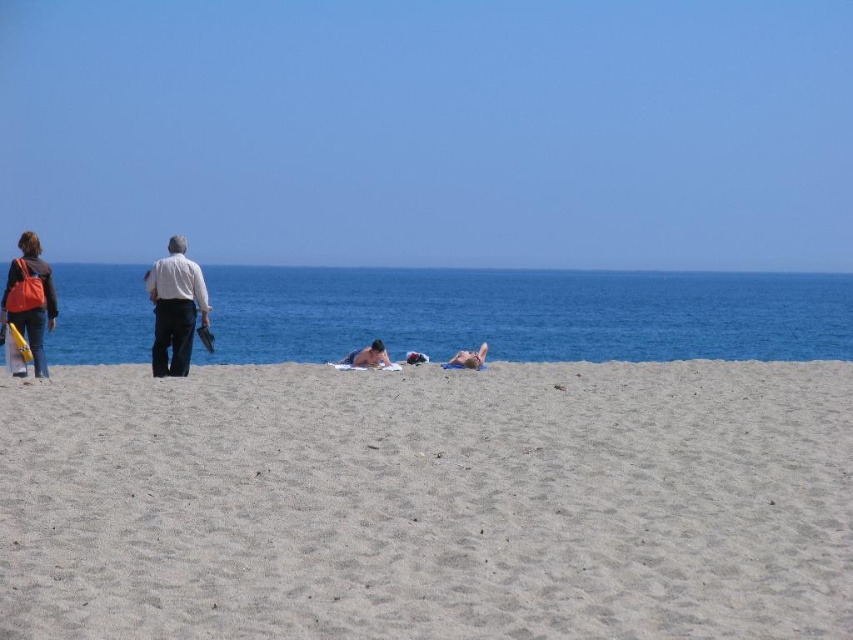
Question: Does light beige sand at center appear under blue water at center?

Choices:
 (A) no
 (B) yes

Answer: (B)

Question: Where is light beige sand at center located in relation to smooth skin at center in the image?

Choices:
 (A) below
 (B) above

Answer: (A)

Question: Is light beige sand at center further to the viewer compared to matte orange bag at left?

Choices:
 (A) yes
 (B) no

Answer: (B)

Question: Among these objects, which one is nearest to the camera?

Choices:
 (A) smooth tan skin at center
 (B) matte orange bag at left
 (C) smooth skin at center
 (D) blue water at center

Answer: (B)

Question: Among these objects, which one is farthest from the camera?

Choices:
 (A) light beige sand at center
 (B) smooth tan skin at center
 (C) matte orange bag at left
 (D) white shirt at center

Answer: (B)

Question: Which object is positioned farthest from the blue water at center?

Choices:
 (A) blue sky at upper center
 (B) light beige sand at center
 (C) white shirt at center

Answer: (C)